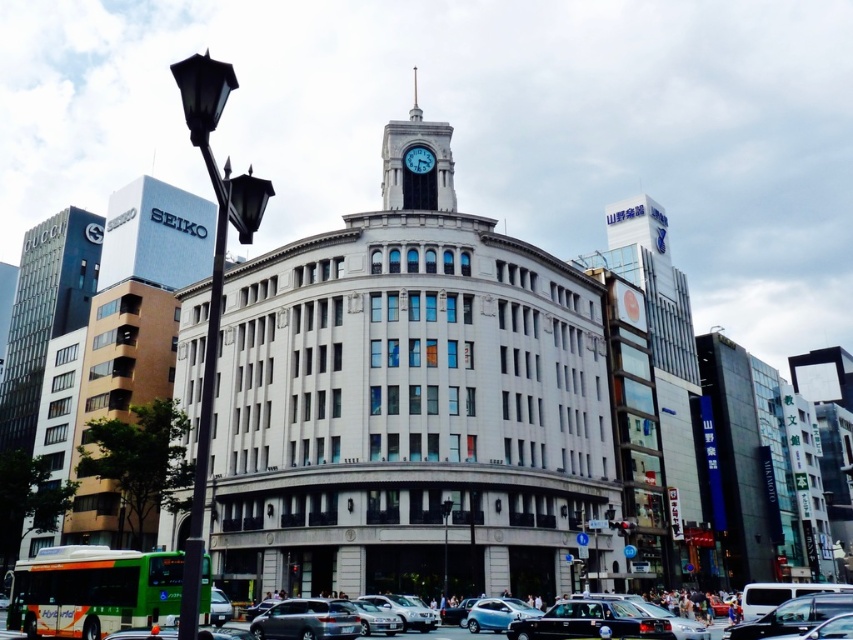
Can you confirm if silver metallic van at center is wider than metallic silver sedan at center?

Incorrect, silver metallic van at center's width does not surpass metallic silver sedan at center's.

Can you confirm if silver metallic van at center is shorter than metallic silver sedan at center?

Correct, silver metallic van at center is not as tall as metallic silver sedan at center.

Which is behind, point (344, 636) or point (496, 624)?

The point (496, 624) is behind.

Image resolution: width=853 pixels, height=640 pixels. Find the location of `silver metallic van at center`. silver metallic van at center is located at coordinates (306, 620).

How far apart are metallic silver car at center and white glossy clock at upper center?

metallic silver car at center and white glossy clock at upper center are 41.91 meters apart from each other.

Does metallic silver car at center have a greater width compared to white glossy clock at upper center?

Incorrect, metallic silver car at center's width does not surpass white glossy clock at upper center's.

Image resolution: width=853 pixels, height=640 pixels. Describe the element at coordinates (792, 616) in the screenshot. I see `metallic silver car at center` at that location.

This screenshot has width=853, height=640. I want to click on metallic silver car at center, so click(792, 616).

Who is more forward, (426, 296) or (410, 172)?

Point (426, 296) is in front.

Is white stone clock tower at center bigger than white glossy clock at upper center?

Indeed, white stone clock tower at center has a larger size compared to white glossy clock at upper center.

Is point (457, 563) positioned behind point (409, 170)?

That is False.

At what (x,y) coordinates should I click in order to perform the action: click on white stone clock tower at center. Please return your answer as a coordinate pair (x, y). The width and height of the screenshot is (853, 640). Looking at the image, I should click on (410, 413).